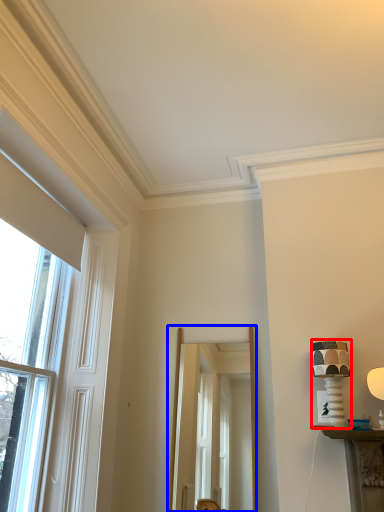
Question: Which object is closer to the camera taking this photo, table lamp (highlighted by a red box) or screen door (highlighted by a blue box)?

Choices:
 (A) table lamp
 (B) screen door

Answer: (A)